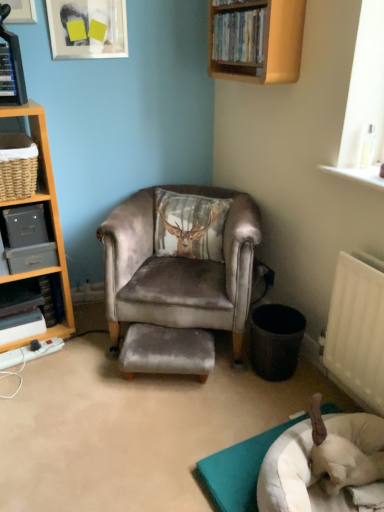
Question: Relative to metallic gray shelf at left, the 4th shelf when ordered from right to left, is white fabric dog bed at lower right in front or behind?

Choices:
 (A) front
 (B) behind

Answer: (A)

Question: Is white fabric dog bed at lower right inside the boundaries of metallic gray shelf at left, placed as the fourth shelf when sorted from top to bottom, or outside?

Choices:
 (A) inside
 (B) outside

Answer: (B)

Question: Estimate the real-world distances between objects in this image. Which object is farther from the metallic gray file cabinet at left, which is the 3th shelf in top-to-bottom order?

Choices:
 (A) metallic silver picture frame at upper left
 (B) hardcover book at left, the second book when ordered from top to bottom
 (C) wooden shelf at upper center, the 4th shelf positioned from the bottom
 (D) metallic gray shelf at left, placed as the fourth shelf when sorted from top to bottom
 (E) white fabric dog bed at lower right

Answer: (E)

Question: Based on their relative distances, which object is farther from the black plastic trash can at lower right?

Choices:
 (A) white fabric dog bed at lower right
 (B) wooden shelf at upper left
 (C) metallic gray file cabinet at left, the second shelf ordered from the bottom
 (D) hardcover book at left, the second book when ordered from top to bottom
 (E) velvet grey stool at center

Answer: (B)